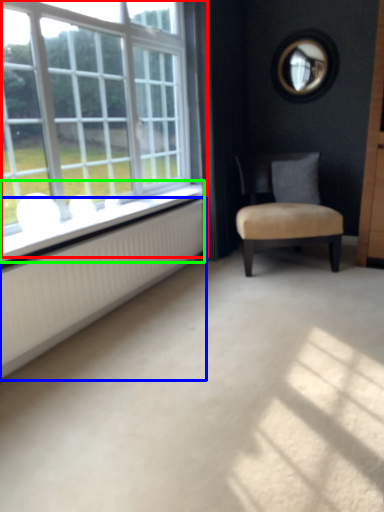
Question: Which object is positioned closest to window (highlighted by a red box)? Select from radiator (highlighted by a blue box) and window sill (highlighted by a green box).

Choices:
 (A) radiator
 (B) window sill

Answer: (B)